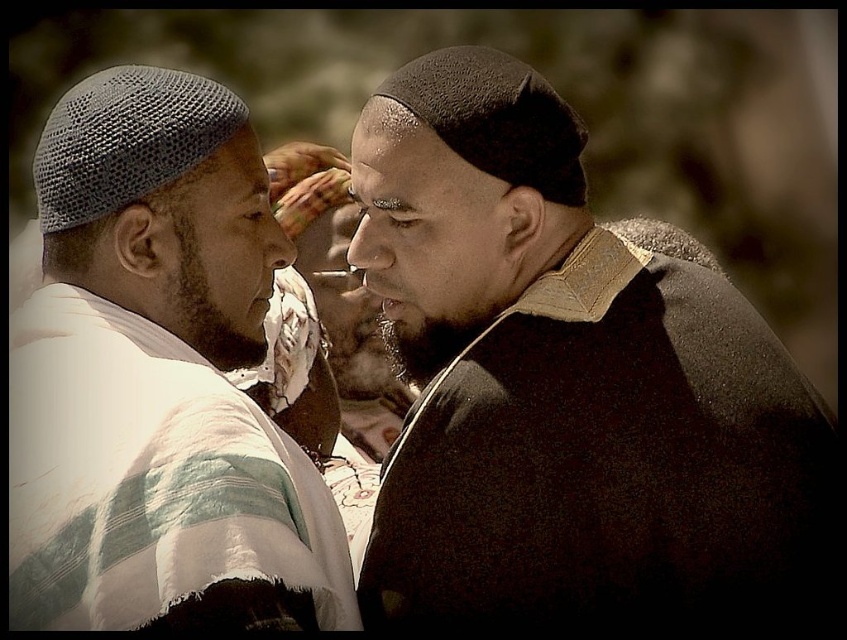
Question: Which object appears closest to the camera in this image?

Choices:
 (A) black fuzzy hat at upper center
 (B) smooth brown leather jacket at center
 (C) white striped fabric at left

Answer: (C)

Question: Among these points, which one is farthest from the camera?

Choices:
 (A) (358, 348)
 (B) (241, 134)

Answer: (A)

Question: Which of the following is the closest to the observer?

Choices:
 (A) (65, 280)
 (B) (587, 508)

Answer: (B)

Question: Is white striped fabric at left bigger than smooth brown leather jacket at center?

Choices:
 (A) yes
 (B) no

Answer: (A)

Question: Is white striped fabric at left to the right of smooth brown leather jacket at center from the viewer's perspective?

Choices:
 (A) no
 (B) yes

Answer: (A)

Question: In this image, where is white striped fabric at left located relative to smooth brown leather jacket at center?

Choices:
 (A) left
 (B) right

Answer: (A)